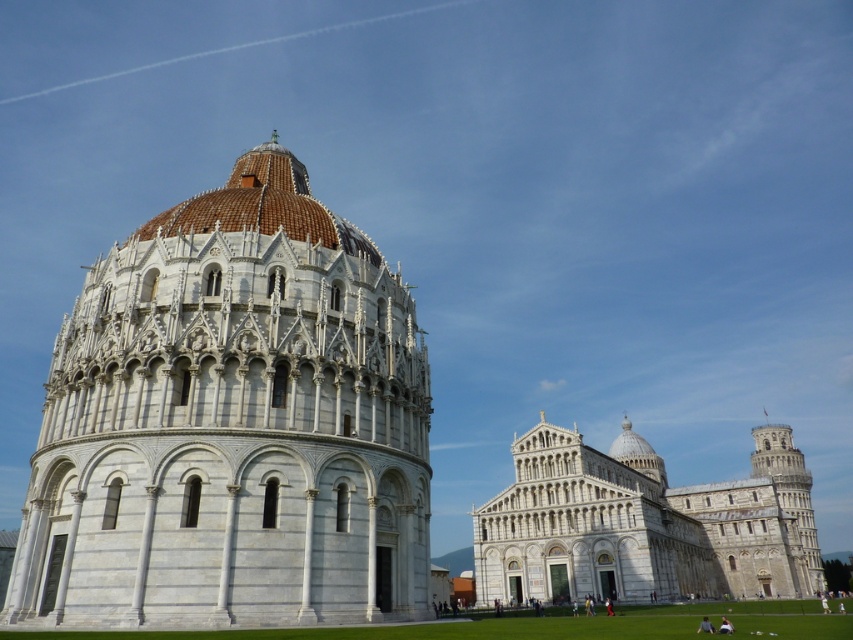
You are a tourist standing at the exact center of the Piazza dei Miracoli. You want to take a photo of the white marble tower at center. In which direction should you walk to get closer to it?

Since the white marble tower at center is located at point 0.664 on the x axis and 0.273 on the y axis, you should walk towards the direction of the tower which is northeast from your current position at the center of the piazza.

Based on the photo, you are standing in the Piazza dei Miracoli in Pisa, Italy, and you want to take a photo of both the white marble tower at center and the white stone cathedral at center. Based on their positions, which one should you focus on first to ensure both are in the frame?

You should focus on the white marble tower at center first because it is closer to you than the white stone cathedral at center, so by centering the tower, the cathedral will naturally fall into the background of the frame.